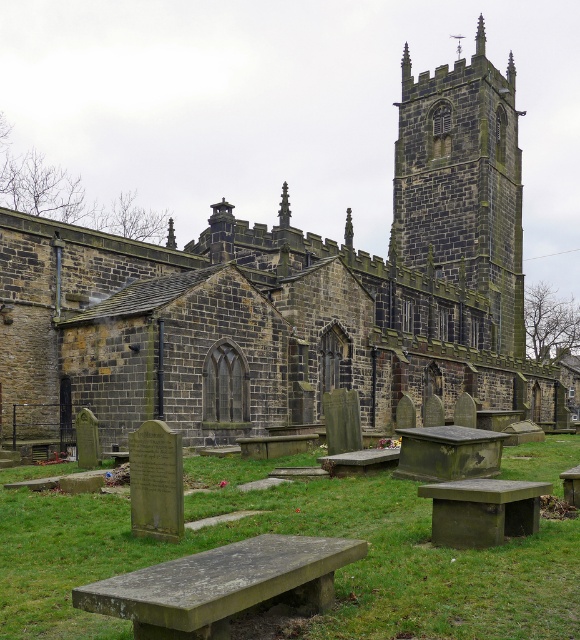
You are a visitor standing at the concrete bench at lower center and want to take a photo of the dark gray stone church at center. If your camera has a maximum zoom range of 100 feet, will you be able to capture the church in full without moving closer?

The dark gray stone church at center and concrete bench at lower center are 155.72 feet apart. Since the camera can only zoom up to 100 feet, you won t be able to capture the church in full without moving closer.